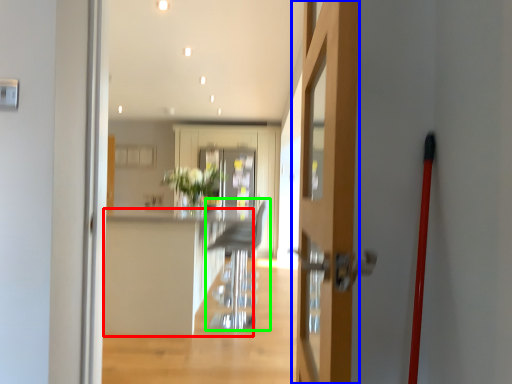
Question: Based on their relative distances, which object is nearer to counter top (highlighted by a red box)? Choose from door (highlighted by a blue box) and armchair (highlighted by a green box).

Choices:
 (A) door
 (B) armchair

Answer: (B)